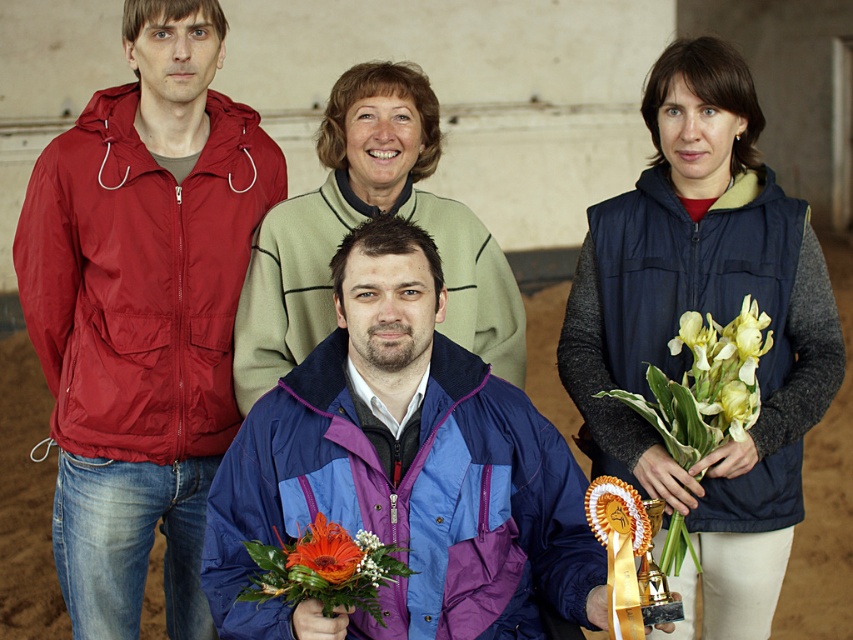
Between blue-purple nylon jacket at center and navy blue vest at center, which one appears on the right side from the viewer's perspective?

Positioned to the right is navy blue vest at center.

Can you confirm if blue-purple nylon jacket at center is thinner than navy blue vest at center?

No.

Which is in front, point (535, 458) or point (706, 536)?

Point (535, 458) is more forward.

Locate an element on the screen. The image size is (853, 640). blue-purple nylon jacket at center is located at coordinates (404, 470).

This screenshot has height=640, width=853. Describe the element at coordinates (712, 317) in the screenshot. I see `navy blue vest at center` at that location.

Between point (804, 369) and point (701, 332), which one is positioned in front?

Point (701, 332) is more forward.

Is point (613, 435) more distant than point (723, 344)?

That is True.

In order to click on navy blue vest at center in this screenshot , I will do `click(712, 317)`.

Who is more distant from viewer, (210, 234) or (677, 339)?

Point (210, 234)

Between point (213, 352) and point (706, 314), which one is positioned in front?

Point (706, 314) is in front.

Does point (190, 74) lie in front of point (746, 426)?

That is False.

The height and width of the screenshot is (640, 853). I want to click on matte red jacket at left, so click(142, 310).